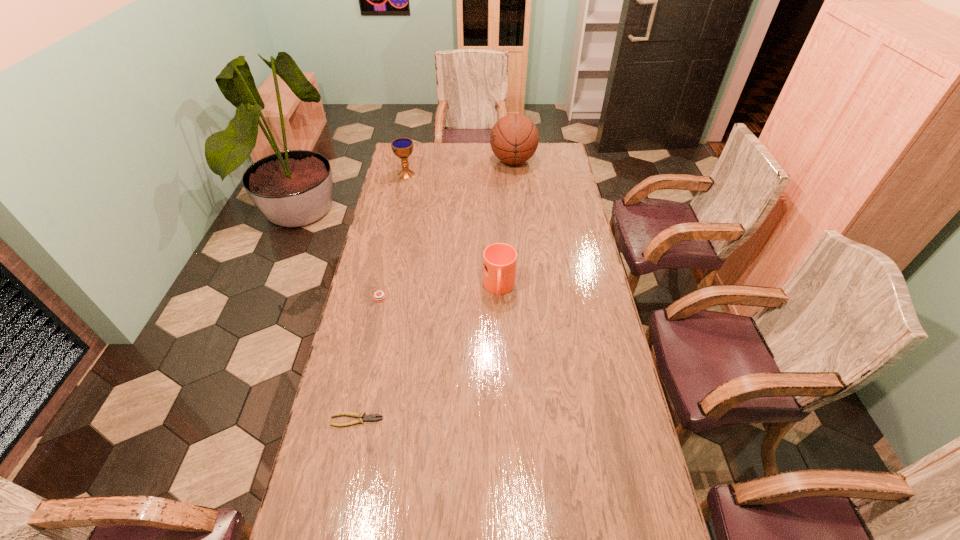
Where is `vacant space at the left edge`? This screenshot has height=540, width=960. vacant space at the left edge is located at coordinates (405, 207).

In the image, there is a desktop. At what (x,y) coordinates should I click in order to perform the action: click on vacant space at the right edge. Please return your answer as a coordinate pair (x, y). Looking at the image, I should click on (591, 352).

Locate an element on the screen. This screenshot has width=960, height=540. vacant space at the far left corner is located at coordinates (412, 165).

Locate an element on the screen. Image resolution: width=960 pixels, height=540 pixels. empty space that is in between the second shortest object and the chalice is located at coordinates (393, 236).

At what (x,y) coordinates should I click in order to perform the action: click on vacant space in between the nearest object and the second shortest object. Please return your answer as a coordinate pair (x, y). This screenshot has height=540, width=960. Looking at the image, I should click on tap(369, 359).

This screenshot has height=540, width=960. Find the location of `blank region between the second shortest object and the mug`. blank region between the second shortest object and the mug is located at coordinates (440, 293).

Where is `vacant point located between the mug and the tallest object`? The image size is (960, 540). vacant point located between the mug and the tallest object is located at coordinates (506, 225).

You are a GUI agent. You are given a task and a screenshot of the screen. Output one action in this format:
    pyautogui.click(x=<x>, y=<y>)
    Task: Click on the object that is the fourth closest to the fourth tallest object
    
    Given the screenshot: What is the action you would take?
    pyautogui.click(x=514, y=138)

This screenshot has width=960, height=540. I want to click on object that ranks as the second closest to the fourth tallest object, so click(371, 417).

This screenshot has width=960, height=540. What are the coordinates of `free spot that satisfies the following two spatial constraints: 1. on the front side of the second shortest object; 2. on the right side of the nearest object` in the screenshot? It's located at (354, 420).